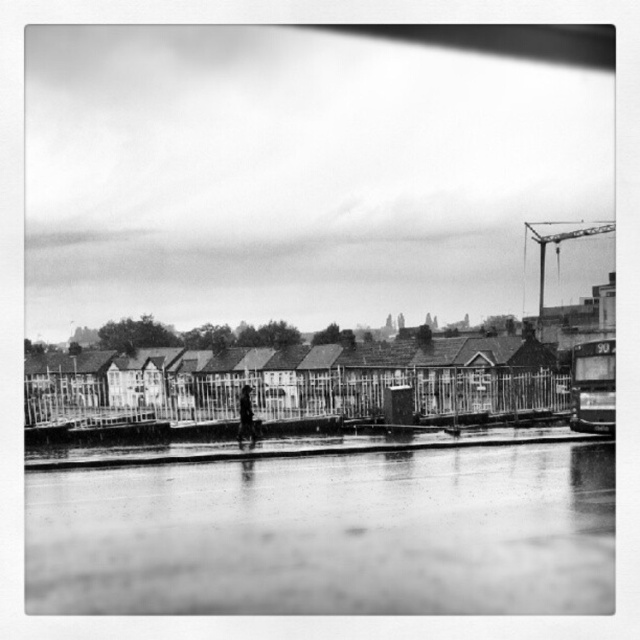
Question: Among these points, which one is farthest from the camera?

Choices:
 (A) (237, 400)
 (B) (406, 531)

Answer: (A)

Question: Does wet asphalt flood at lower center lie in front of metallic gray crane at upper right?

Choices:
 (A) yes
 (B) no

Answer: (A)

Question: Which point appears closest to the camera in this image?

Choices:
 (A) (570, 232)
 (B) (252, 568)
 (C) (250, 433)

Answer: (B)

Question: Is metallic gray crane at upper right positioned in front of dark clothing figure at center?

Choices:
 (A) yes
 (B) no

Answer: (B)

Question: Which object appears closest to the camera in this image?

Choices:
 (A) wet asphalt flood at lower center
 (B) dark clothing figure at center
 (C) metallic gray crane at upper right

Answer: (A)

Question: Is wet asphalt flood at lower center positioned behind dark clothing figure at center?

Choices:
 (A) yes
 (B) no

Answer: (B)